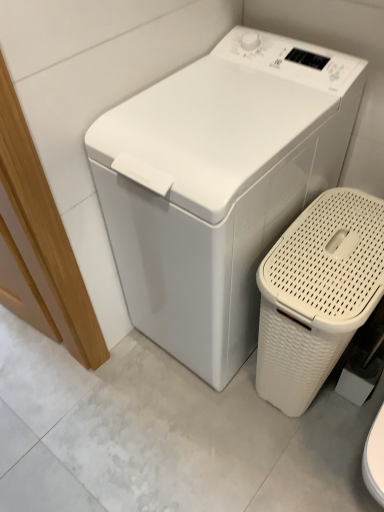
Question: In terms of width, does white woven basket at lower right look wider or thinner when compared to white plastic washing machine at center?

Choices:
 (A) wide
 (B) thin

Answer: (B)

Question: Is white woven basket at lower right in front of or behind white plastic washing machine at center in the image?

Choices:
 (A) behind
 (B) front

Answer: (A)

Question: Is white woven basket at lower right spatially inside white plastic washing machine at center, or outside of it?

Choices:
 (A) outside
 (B) inside

Answer: (A)

Question: Visually, is white plastic washing machine at center positioned to the left or to the right of white woven basket at lower right?

Choices:
 (A) right
 (B) left

Answer: (B)

Question: From the image's perspective, is white plastic washing machine at center above or below white woven basket at lower right?

Choices:
 (A) below
 (B) above

Answer: (B)

Question: From a real-world perspective, is white plastic washing machine at center positioned above or below white woven basket at lower right?

Choices:
 (A) above
 (B) below

Answer: (A)

Question: In terms of height, does white plastic washing machine at center look taller or shorter compared to white woven basket at lower right?

Choices:
 (A) tall
 (B) short

Answer: (A)